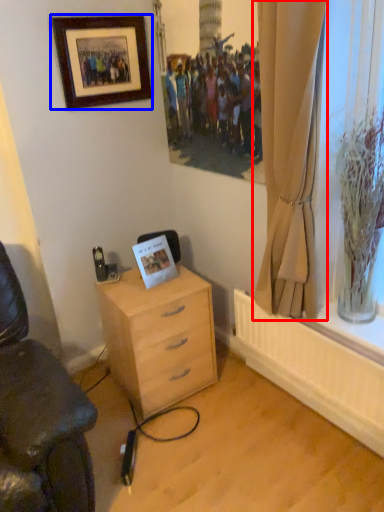
Question: Among these objects, which one is nearest to the camera, curtain (highlighted by a red box) or picture frame (highlighted by a blue box)?

Choices:
 (A) curtain
 (B) picture frame

Answer: (A)